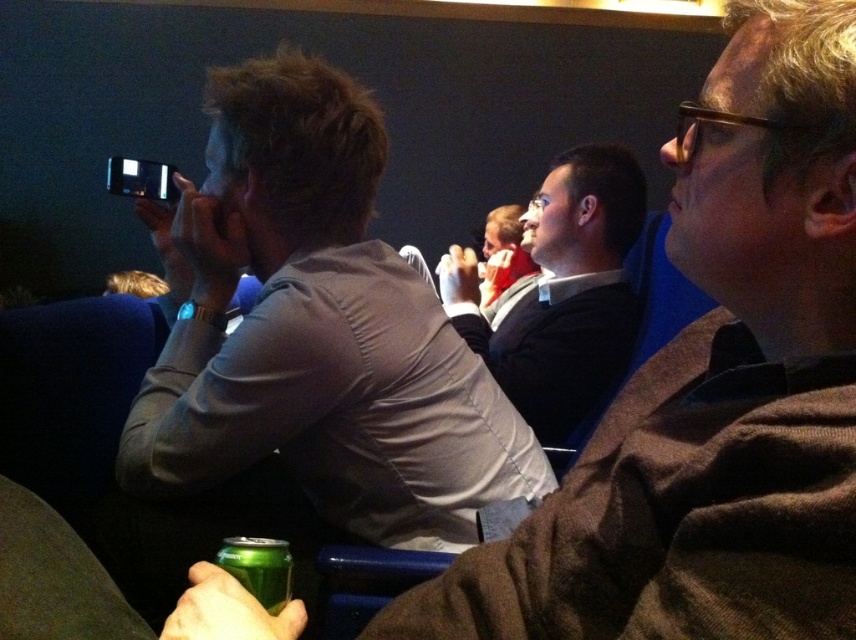
Question: Where is dark gray suit at center located in relation to green metallic can at lower left in the image?

Choices:
 (A) above
 (B) below

Answer: (A)

Question: Does matte gray shirt at center appear under green metallic can at lower left?

Choices:
 (A) yes
 (B) no

Answer: (B)

Question: Can you confirm if matte gray shirt at center is positioned to the left of green metallic can at lower left?

Choices:
 (A) yes
 (B) no

Answer: (A)

Question: Which point appears farthest from the camera in this image?

Choices:
 (A) (498, 376)
 (B) (342, 266)
 (C) (217, 552)

Answer: (A)

Question: Which point is farther from the camera taking this photo?

Choices:
 (A) (260, 548)
 (B) (171, 278)

Answer: (B)

Question: Estimate the real-world distances between objects in this image. Which object is farther from the dark gray suit at center?

Choices:
 (A) green metallic can at lower left
 (B) matte gray shirt at center

Answer: (A)